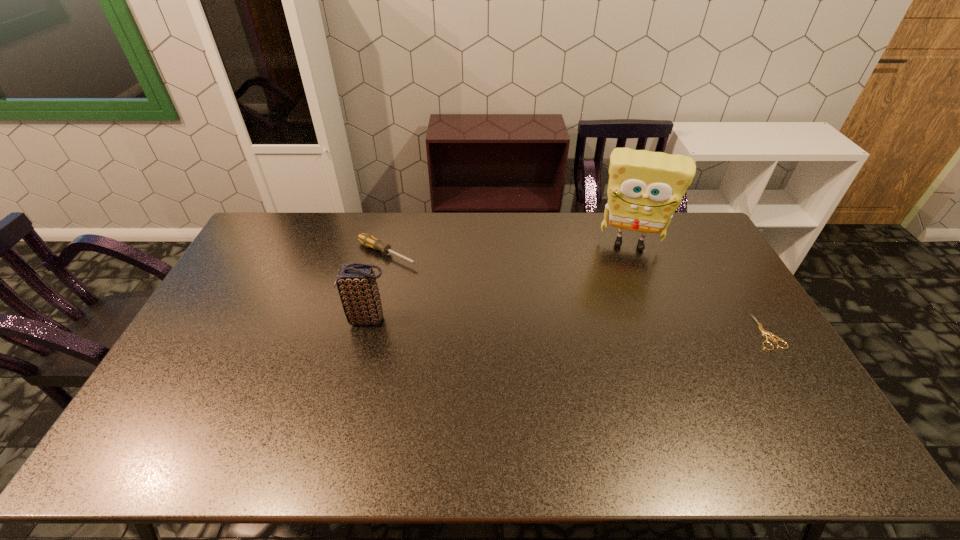
Where is `free space on the desktop that is between the second tallest object and the shortest object and is positioned at the tip of the screwdriver`? free space on the desktop that is between the second tallest object and the shortest object and is positioned at the tip of the screwdriver is located at coordinates (536, 325).

Where is `free space on the desktop that is between the clutch bag and the shears and is positioned on the face of the second object from right to left`? The width and height of the screenshot is (960, 540). free space on the desktop that is between the clutch bag and the shears and is positioned on the face of the second object from right to left is located at coordinates (623, 328).